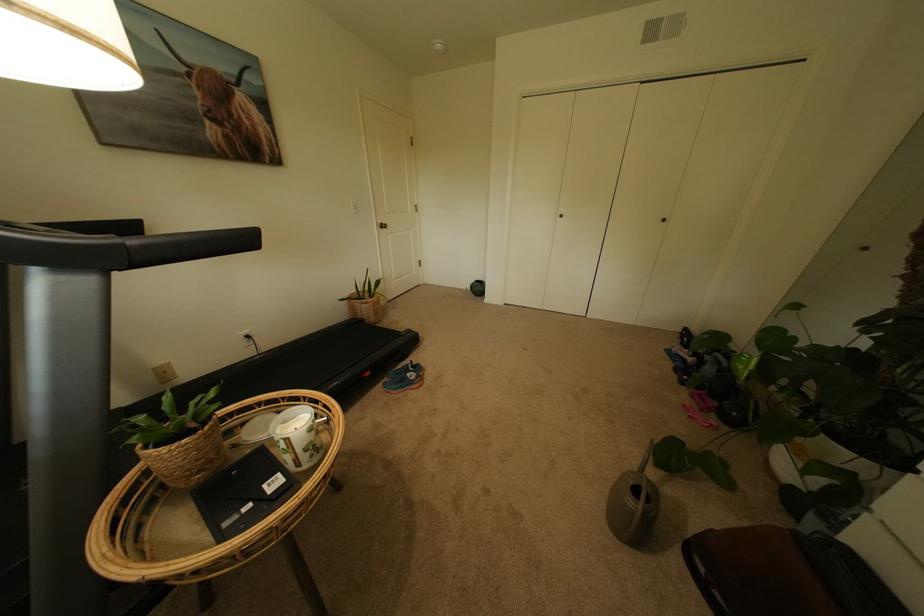
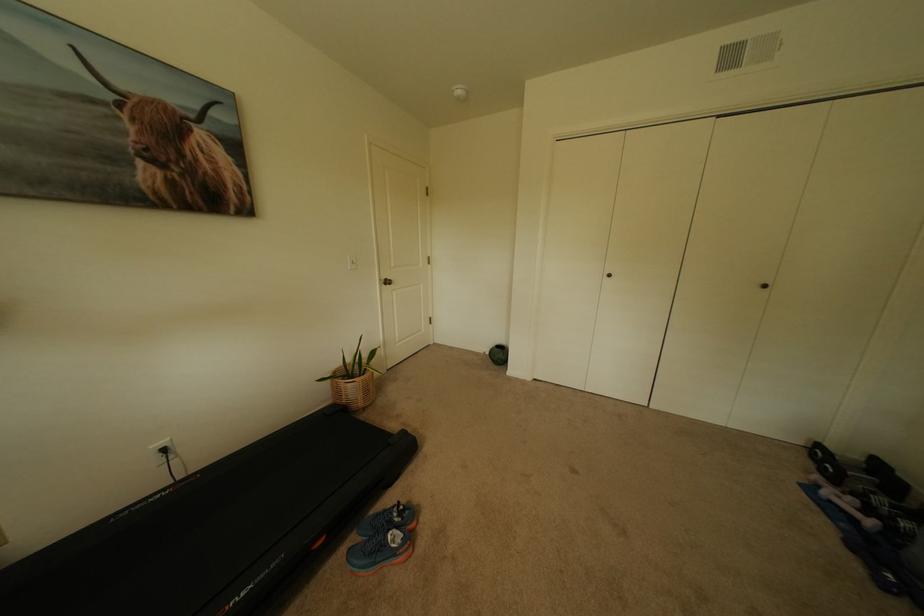
The point at (x=382, y=314) is marked in the first image. Where is the corresponding point in the second image?

(370, 395)